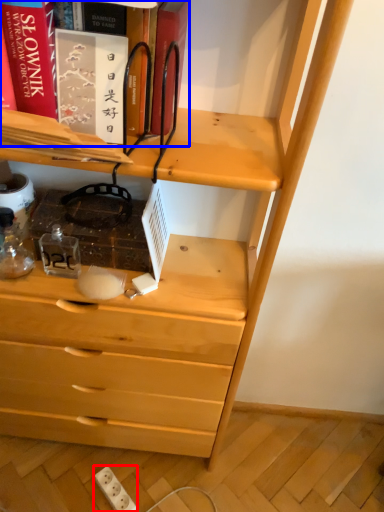
Question: Which of the following is the farthest to the observer, electric outlet (highlighted by a red box) or book (highlighted by a blue box)?

Choices:
 (A) electric outlet
 (B) book

Answer: (A)